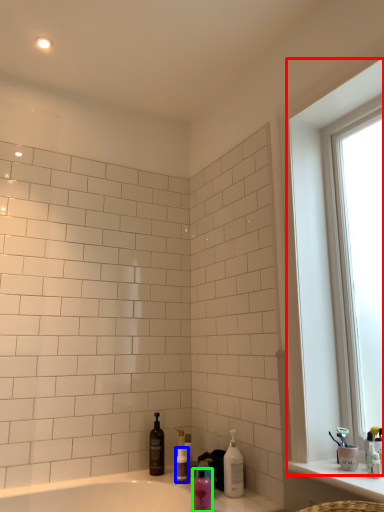
Question: Which object is positioned farthest from window (highlighted by a red box)? Select from toiletry (highlighted by a blue box) and mouthwash (highlighted by a green box).

Choices:
 (A) toiletry
 (B) mouthwash

Answer: (A)